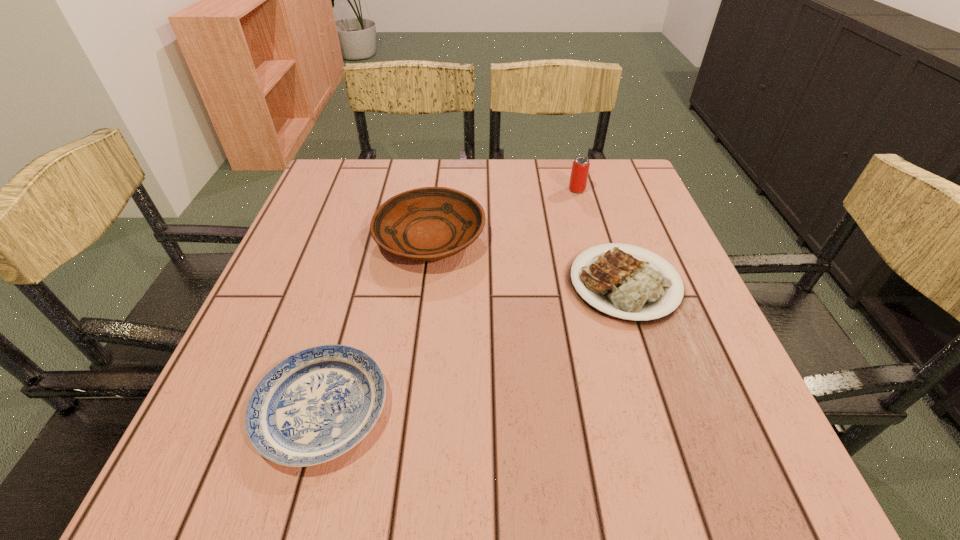
Find the location of a particular element. The width and height of the screenshot is (960, 540). free space at the far left corner of the desktop is located at coordinates (326, 174).

Image resolution: width=960 pixels, height=540 pixels. Identify the location of free point at the near right corner. (689, 488).

What are the coordinates of `empty space between the tallest plate and the nearest object` in the screenshot? It's located at (376, 323).

Locate an element on the screen. The height and width of the screenshot is (540, 960). vacant space in between the nearest object and the rightmost plate is located at coordinates (473, 346).

I want to click on vacant space in between the nearest object and the rightmost plate, so click(x=473, y=346).

Image resolution: width=960 pixels, height=540 pixels. Identify the location of vacant area between the rightmost plate and the nearest plate. (473, 346).

You are a GUI agent. You are given a task and a screenshot of the screen. Output one action in this format:
    pyautogui.click(x=<x>, y=<y>)
    Task: Click on the free space between the tallest plate and the rightmost plate
    This screenshot has height=540, width=960.
    Given the screenshot: What is the action you would take?
    pyautogui.click(x=527, y=261)

You are a GUI agent. You are given a task and a screenshot of the screen. Output one action in this format:
    pyautogui.click(x=<x>, y=<y>)
    Task: Click on the vacant point located between the rightmost plate and the tallest object
    The height and width of the screenshot is (540, 960).
    Given the screenshot: What is the action you would take?
    pyautogui.click(x=601, y=237)

The height and width of the screenshot is (540, 960). In order to click on vacant space that is in between the rightmost plate and the farthest object in this screenshot , I will do tap(601, 237).

Image resolution: width=960 pixels, height=540 pixels. Identify the location of free space between the rightmost plate and the tallest object. (601, 237).